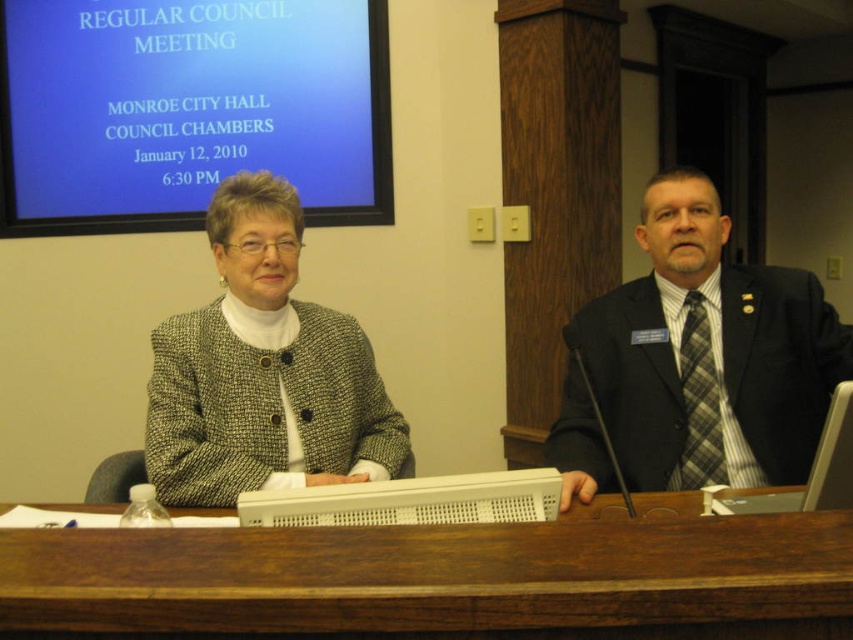
Which of these two, blue glossy projector screen at upper center or white plastic laptop at center, stands shorter?

white plastic laptop at center

Who is positioned more to the right, blue glossy projector screen at upper center or white plastic laptop at center?

white plastic laptop at center

Where is `blue glossy projector screen at upper center`? This screenshot has height=640, width=853. blue glossy projector screen at upper center is located at coordinates (189, 109).

At what (x,y) coordinates should I click in order to perform the action: click on blue glossy projector screen at upper center. Please return your answer as a coordinate pair (x, y). Looking at the image, I should click on (189, 109).

Does brown wood table at center have a smaller size compared to plastic keyboard at center?

Yes, brown wood table at center is smaller than plastic keyboard at center.

Is point (775, 566) less distant than point (849, 468)?

Yes, point (775, 566) is closer to viewer.

Where is `brown wood table at center`? This screenshot has height=640, width=853. brown wood table at center is located at coordinates (444, 579).

Between point (700, 422) and point (346, 492), which one is positioned behind?

The point (700, 422) is behind.

Who is more forward, (x=728, y=378) or (x=550, y=502)?

Point (x=550, y=502) is more forward.

Find the location of a particular element. The width and height of the screenshot is (853, 640). dark blue suit at right is located at coordinates (711, 355).